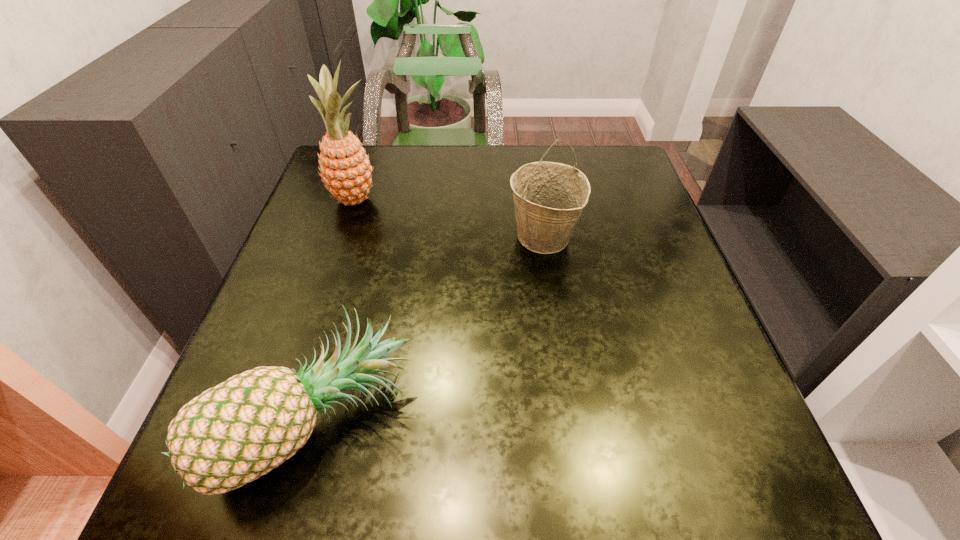
Locate an element on the screen. This screenshot has height=540, width=960. object that is the nearest to the shortest object is located at coordinates (549, 197).

What are the coordinates of `free region that satisfies the following two spatial constraints: 1. on the front side of the farther pineapple; 2. on the left side of the rightmost object` in the screenshot? It's located at (343, 237).

Locate an element on the screen. free space that satisfies the following two spatial constraints: 1. on the back side of the shortest object; 2. on the right side of the second shortest object is located at coordinates (366, 237).

The height and width of the screenshot is (540, 960). What are the coordinates of `free location that satisfies the following two spatial constraints: 1. on the front side of the wine bucket; 2. on the left side of the farther pineapple` in the screenshot? It's located at point(343,237).